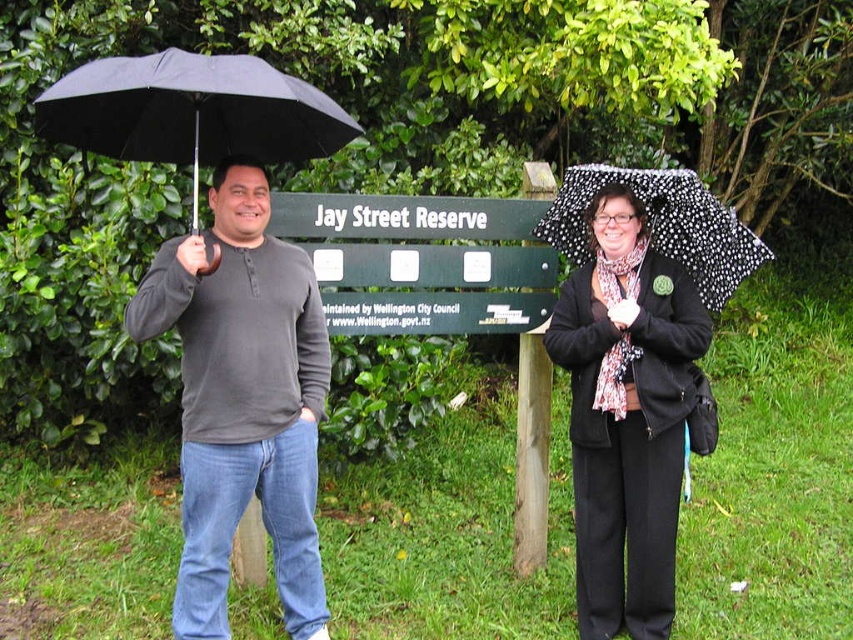
Question: Can you confirm if black woolen jacket at center is thinner than black matte umbrella at left?

Choices:
 (A) no
 (B) yes

Answer: (B)

Question: Based on their relative distances, which object is nearer to the black matte umbrella at left?

Choices:
 (A) black woolen jacket at center
 (B) black dotted umbrella at upper right
 (C) dark gray henley shirt at left

Answer: (C)

Question: Estimate the real-world distances between objects in this image. Which object is farther from the dark gray henley shirt at left?

Choices:
 (A) black matte umbrella at left
 (B) black woolen jacket at center

Answer: (B)

Question: Does dark gray henley shirt at left appear on the right side of black dotted umbrella at upper right?

Choices:
 (A) yes
 (B) no

Answer: (B)

Question: Considering the real-world distances, which object is closest to the black matte umbrella at left?

Choices:
 (A) dark gray henley shirt at left
 (B) black woolen jacket at center
 (C) black dotted umbrella at upper right

Answer: (A)

Question: Observing the image, what is the correct spatial positioning of dark gray henley shirt at left in reference to black woolen jacket at center?

Choices:
 (A) right
 (B) left

Answer: (B)